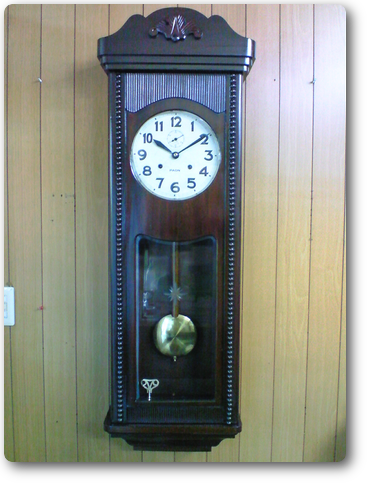
Identify the location of wood panelling. This screenshot has width=367, height=483. (63, 245).